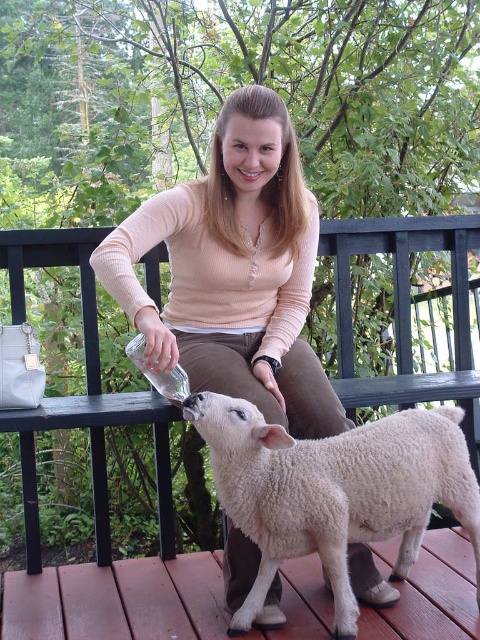
You are a photographer standing in front of the wooden deck. You see the matte peach sweater at center and the white woolen lamb at lower center. Which object is located more to the left?

The matte peach sweater at center is more to the left than the white woolen lamb at lower center because it is positioned on the left side of the white woolen lamb at lower center.